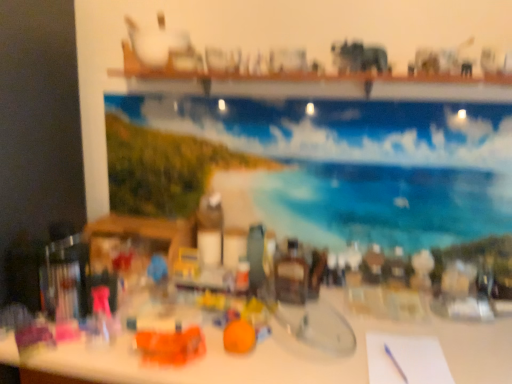
Question: From a real-world perspective, is blue glossy painting at upper center under orange plastic toy at center, placed as the first toy when sorted from left to right?

Choices:
 (A) no
 (B) yes

Answer: (A)

Question: Can you confirm if blue glossy painting at upper center is thinner than orange plastic toy at center, which is the 2th toy from right to left?

Choices:
 (A) yes
 (B) no

Answer: (A)

Question: Would you consider blue glossy painting at upper center to be distant from orange plastic toy at center, which is the 2th toy from right to left?

Choices:
 (A) no
 (B) yes

Answer: (A)

Question: Does blue glossy painting at upper center have a greater height compared to orange plastic toy at center, placed as the first toy when sorted from left to right?

Choices:
 (A) no
 (B) yes

Answer: (B)

Question: Can we say blue glossy painting at upper center lies outside orange plastic toy at center, which is the 2th toy from right to left?

Choices:
 (A) yes
 (B) no

Answer: (A)

Question: Based on their positions, is white paper at lower right located to the left or right of white glossy table at center?

Choices:
 (A) left
 (B) right

Answer: (B)

Question: From the image's perspective, is white paper at lower right positioned above or below white glossy table at center?

Choices:
 (A) above
 (B) below

Answer: (A)

Question: Relative to white glossy table at center, is white paper at lower right in front or behind?

Choices:
 (A) front
 (B) behind

Answer: (B)

Question: From a real-world perspective, relative to white glossy table at center, is white paper at lower right vertically above or below?

Choices:
 (A) above
 (B) below

Answer: (A)

Question: Is orange plastic toy at center, which is the 2th toy from right to left, taller or shorter than white paper at lower right?

Choices:
 (A) tall
 (B) short

Answer: (A)

Question: From the image's perspective, is orange plastic toy at center, placed as the first toy when sorted from left to right, positioned above or below white paper at lower right?

Choices:
 (A) below
 (B) above

Answer: (B)

Question: Is point (145, 339) closer or farther from the camera than point (411, 357)?

Choices:
 (A) closer
 (B) farther

Answer: (A)

Question: Is orange plastic toy at center, which is the 2th toy from right to left, wider or thinner than white paper at lower right?

Choices:
 (A) thin
 (B) wide

Answer: (A)

Question: Based on their sizes in the image, would you say orange plastic toy at center, which is the 2th toy from right to left, is bigger or smaller than orange matte toy at center, which is the 2th toy from left to right?

Choices:
 (A) small
 (B) big

Answer: (B)

Question: Considering the positions of orange plastic toy at center, placed as the first toy when sorted from left to right, and orange matte toy at center, which is counted as the first toy, starting from the right, in the image, is orange plastic toy at center, placed as the first toy when sorted from left to right, wider or thinner than orange matte toy at center, which is counted as the first toy, starting from the right,?

Choices:
 (A) thin
 (B) wide

Answer: (B)